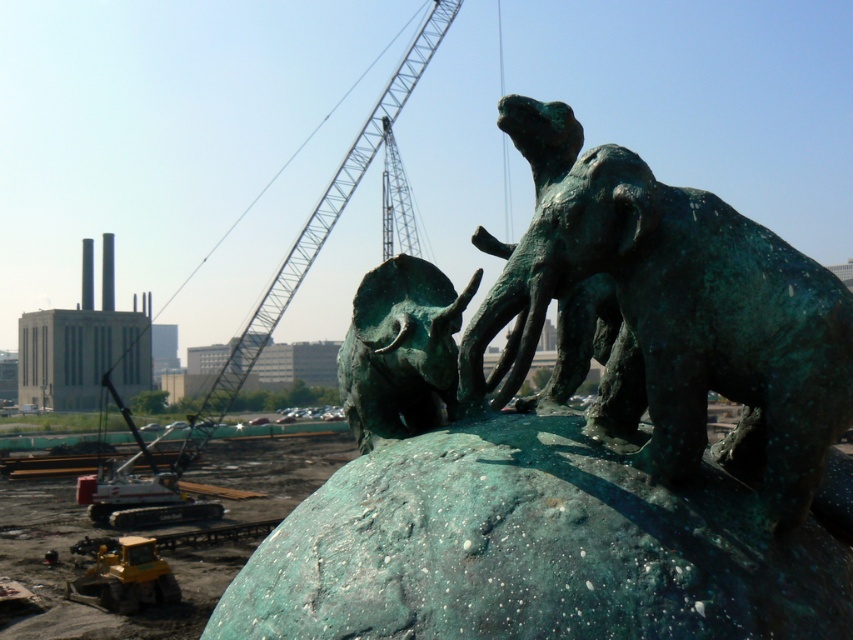
Does green patina bronze elephant at center have a smaller size compared to green patina bull at center?

Incorrect, green patina bronze elephant at center is not smaller in size than green patina bull at center.

Can you confirm if green patina bronze elephant at center is positioned above green patina bull at center?

Yes.

You are a GUI agent. You are given a task and a screenshot of the screen. Output one action in this format:
    pyautogui.click(x=<x>, y=<y>)
    Task: Click on the green patina bronze elephant at center
    
    Given the screenshot: What is the action you would take?
    pyautogui.click(x=671, y=321)

Can you confirm if green patina bull at center is thinner than greenish metallic crane at upper center?

Correct, green patina bull at center's width is less than greenish metallic crane at upper center's.

Who is positioned more to the left, green patina bull at center or greenish metallic crane at upper center?

Positioned to the left is greenish metallic crane at upper center.

Is point (357, 424) positioned behind point (222, 404)?

No, (357, 424) is closer to viewer.

Identify the location of green patina bull at center. (401, 349).

Between green patina bronze elephant at center and greenish metallic crane at upper center, which one appears on the left side from the viewer's perspective?

From the viewer's perspective, greenish metallic crane at upper center appears more on the left side.

Which is above, green patina bronze elephant at center or greenish metallic crane at upper center?

Positioned higher is greenish metallic crane at upper center.

Between point (631, 461) and point (297, 243), which one is positioned behind?

The point (297, 243) is behind.

The height and width of the screenshot is (640, 853). Find the location of `green patina bronze elephant at center`. green patina bronze elephant at center is located at coordinates (671, 321).